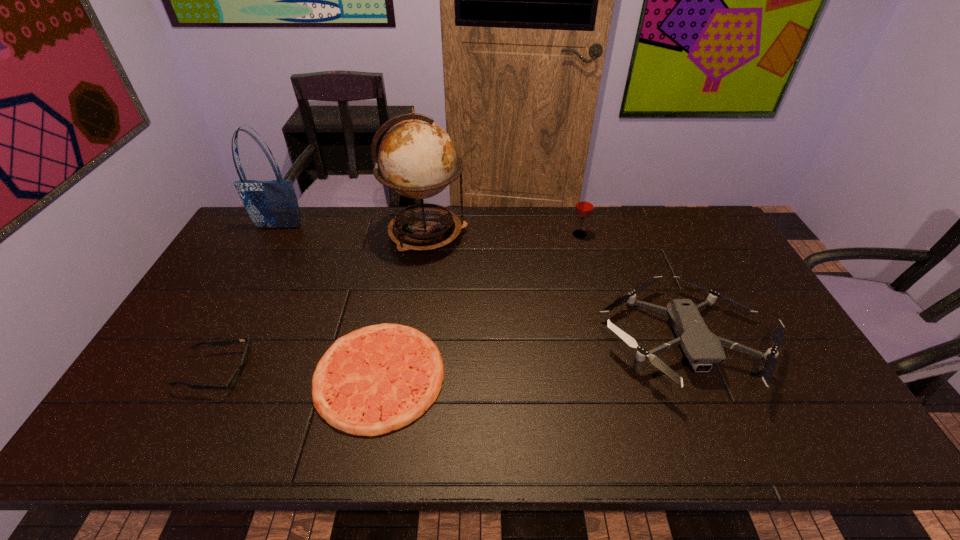
The width and height of the screenshot is (960, 540). Identify the location of vacant space located on the front-facing side of the sunglasses. [x=276, y=372].

Locate an element on the screen. vacant space situated on the right of the shortest object is located at coordinates (574, 376).

Locate an element on the screen. The width and height of the screenshot is (960, 540). globe at the far edge is located at coordinates (417, 158).

The width and height of the screenshot is (960, 540). Find the location of `shopping bag at the far edge`. shopping bag at the far edge is located at coordinates (270, 204).

Find the location of a particular element. The image size is (960, 540). glass that is at the far edge is located at coordinates (584, 207).

Locate an element on the screen. This screenshot has width=960, height=540. object located in the near edge section of the desktop is located at coordinates (379, 378).

Where is `shopping bag located at the left edge`? shopping bag located at the left edge is located at coordinates (270, 204).

Image resolution: width=960 pixels, height=540 pixels. I want to click on sunglasses positioned at the left edge, so (x=234, y=379).

Image resolution: width=960 pixels, height=540 pixels. Find the location of `object at the right edge`. object at the right edge is located at coordinates (702, 348).

Locate an element on the screen. The height and width of the screenshot is (540, 960). object located at the far left corner is located at coordinates (270, 204).